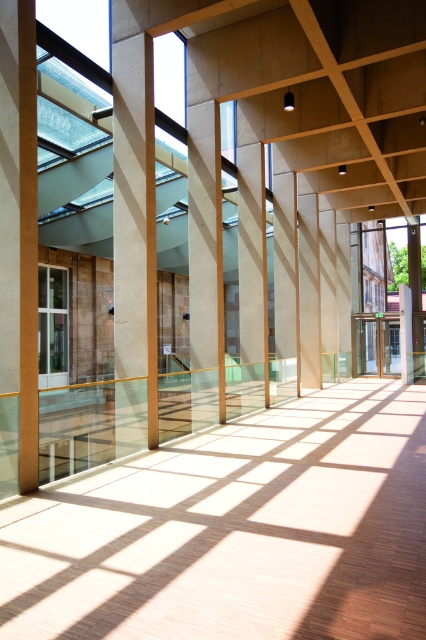
You are standing in the modern interior space and want to avoid stepping on the smooth glass floor at center. According to the coordinates provided, where should you place your feet to stay off it?

The smooth glass floor at center is located at coordinates point (236, 531). To avoid stepping on it, you should place your feet anywhere except that specific point.

You are an architect designing a new installation and need to place a 3D sculpture that requires a base larger than the concrete pillar at center. Can the smooth glass floor at center accommodate this requirement?

The smooth glass floor at center is bigger than the concrete pillar at center, so yes, the smooth glass floor at center can accommodate the sculpture as its base is larger than the concrete pillar at center.

You are a delivery person carrying a large package that is 1.8 meters long. You need to move it through the space shown in the image. Is the smooth glass floor at center wide enough to accommodate the package?

The smooth glass floor at center is 3.60 meters from camera. Since the package is 1.8 meters long, it will fit as the floor is twice the length of the package.